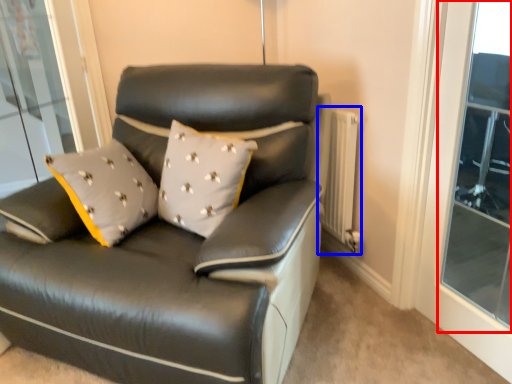
Question: Among these objects, which one is farthest to the camera, window (highlighted by a red box) or radiator (highlighted by a blue box)?

Choices:
 (A) window
 (B) radiator

Answer: (B)